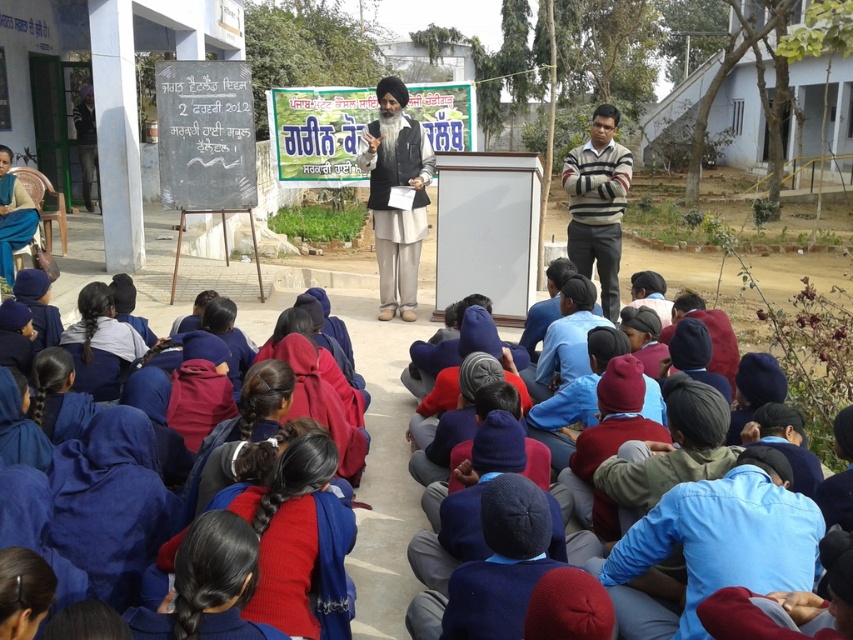
Looking at the light beige fabric turban at center and the striped sweater at right, which one is positioned more to the left side of the image?

The light beige fabric turban at center is positioned to the left of the striped sweater at right, so it is more to the left.

You are a photographer trying to capture a clear photo of the speaker at the podium. You notice the blue cotton shirt at lower right and the light beige fabric turban at center. Which object should you avoid blocking to ensure the speaker is fully visible?

You should avoid blocking the light beige fabric turban at center because the blue cotton shirt at lower right is positioned under it, so the turban is closer to the speaker and blocking it would obscure the speaker more.

You are standing at the front of the scene. Where is the light beige fabric turban at center located relative to your position?

The light beige fabric turban at center is located at point [387,193] relative to your position at the front of the scene.